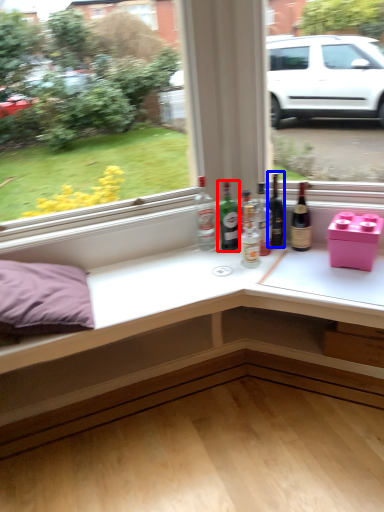
Question: Among these objects, which one is nearest to the camera, bottle (highlighted by a red box) or beer bottle (highlighted by a blue box)?

Choices:
 (A) bottle
 (B) beer bottle

Answer: (B)